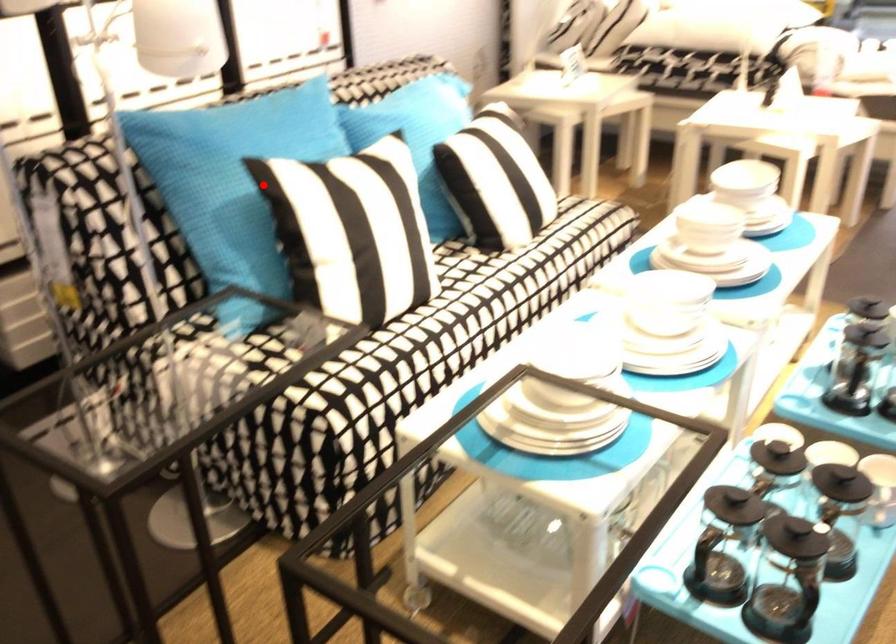
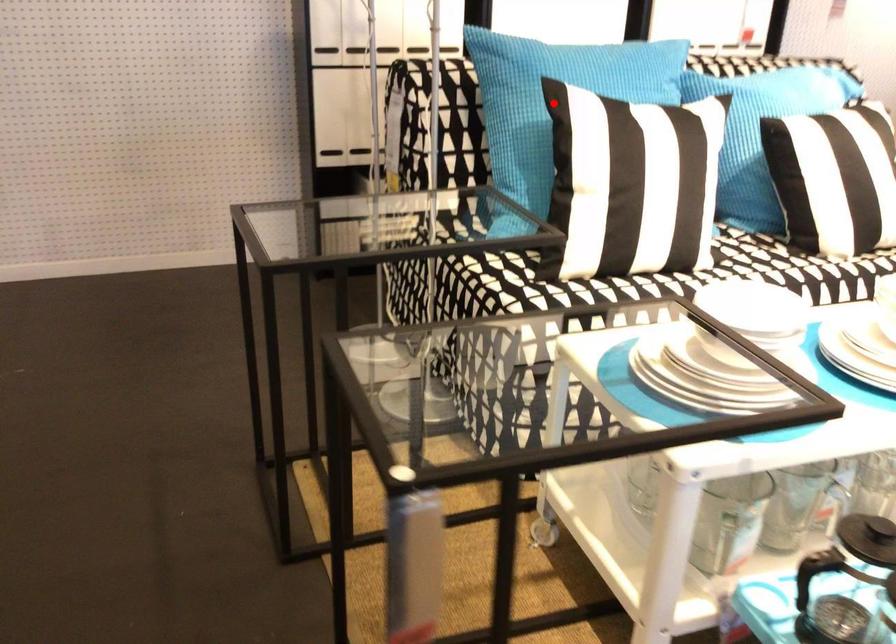
I am providing you with two images of the same scene from different viewpoints. A red point is marked on the first image and another point is marked on the second image. Is the marked point in image1 the same physical position as the marked point in image2?

Yes